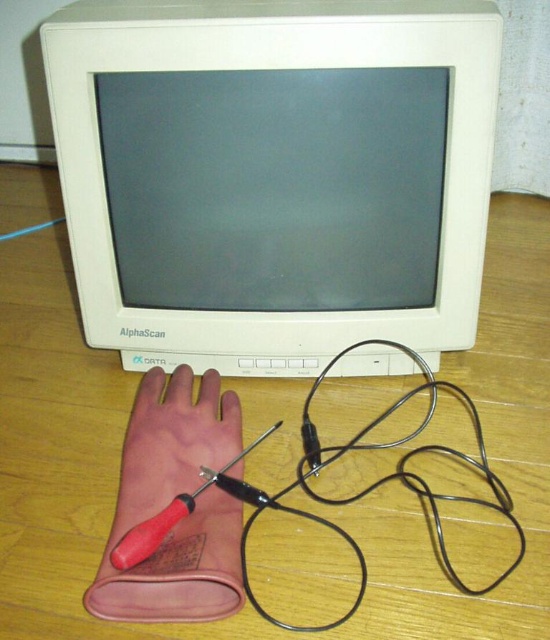
Based on the photo, you are organizing a desk and need to place a book that requires a surface higher than the black metallic wire at lower center. Can the wooden table at center accommodate it?

The wooden table at center is taller than the black metallic wire at lower center, so yes, the wooden table at center can accommodate the book as it provides a higher surface than the wire.

You are organizing a desk and need to place a small item between the white plastic computer monitor at upper center and the brown leather glove at lower left. Based on their positions, where should you place the item to ensure it is closer to the monitor than the glove?

The white plastic computer monitor at upper center is closer to the viewer than the brown leather glove at lower left. To place the item closer to the monitor, position it between the two objects but nearer to the monitor side.

You are a technician trying to repair a CRT monitor. You see the point at coordinates (288, 493). What object is located at this point?

A: The wooden table at center is located at coordinates (288, 493).